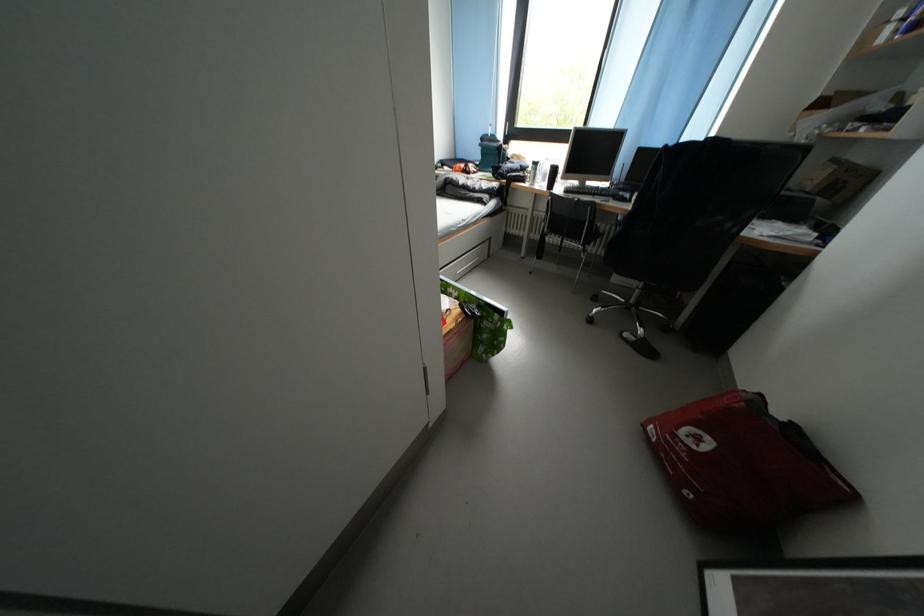
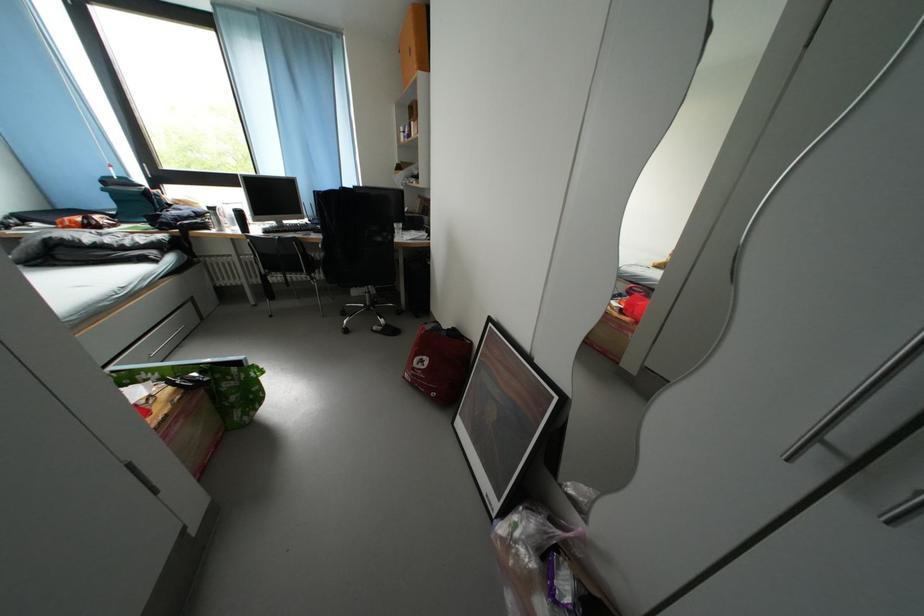
Find the pixel in the second image that matches (433,375) in the first image.

(138, 469)